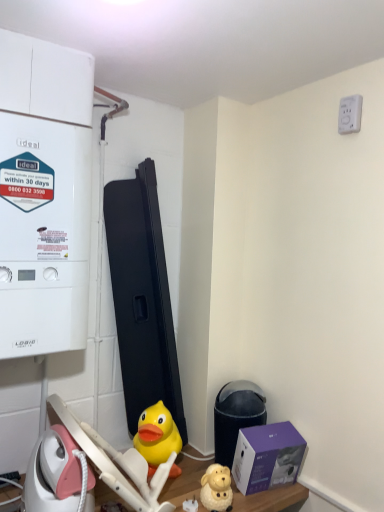
The image size is (384, 512). What do you see at coordinates (43, 234) in the screenshot? I see `white matte boiler at left` at bounding box center [43, 234].

You are a GUI agent. You are given a task and a screenshot of the screen. Output one action in this format:
    pyautogui.click(x=<x>, y=<y>)
    Task: Click on the white matte boiler at left
    The image size is (384, 512).
    Given the screenshot: What is the action you would take?
    pyautogui.click(x=43, y=234)

Could you measure the distance between black plastic water heater at lower right and matte yellow plastic dog at lower center, which appears as the 1th toy when viewed from the front?

8.17 inches.

From the image's perspective, which one is positioned lower, black plastic water heater at lower right or matte yellow plastic dog at lower center, the 1th toy when ordered from right to left?

matte yellow plastic dog at lower center, the 1th toy when ordered from right to left.

Is black plastic water heater at lower right to the left of matte yellow plastic dog at lower center, which appears as the 1th toy when viewed from the front, from the viewer's perspective?

In fact, black plastic water heater at lower right is to the right of matte yellow plastic dog at lower center, which appears as the 1th toy when viewed from the front.

Is black plastic water heater at lower right smaller than matte yellow plastic dog at lower center, which appears as the 1th toy when viewed from the front?

No.

Can you confirm if purple matte box at lower right is thinner than matte yellow plastic dog at lower center, which appears as the 1th toy when viewed from the front?

No.

Is point (247, 475) more distant than point (221, 493)?

Yes.

From a real-world perspective, who is located higher, purple matte box at lower right or matte yellow plastic dog at lower center, the 2th toy when ordered from back to front?

purple matte box at lower right, from a real-world perspective.

Could white matte boiler at left be considered to be inside yellow rubber duck at center, the 1th toy when ordered from back to front?

That's incorrect, white matte boiler at left is not inside yellow rubber duck at center, the 1th toy when ordered from back to front.

From a real-world perspective, which toy is the 1st one underneath the white matte boiler at left? Please provide its 2D coordinates.

[(157, 436)]

Visually, is yellow rubber duck at center, the 1th toy when ordered from back to front, positioned to the left or to the right of white matte boiler at left?

In the image, yellow rubber duck at center, the 1th toy when ordered from back to front, appears on the right side of white matte boiler at left.

From a real-world perspective, is yellow rubber duck at center, placed as the second toy when sorted from right to left, over white matte boiler at left?

No.

From a real-world perspective, is white matte boiler at left physically located above or below purple matte box at lower right?

white matte boiler at left is situated higher than purple matte box at lower right in the real world.

Is white matte boiler at left positioned in front of purple matte box at lower right?

Yes, it is.

Considering the positions of objects white matte boiler at left and purple matte box at lower right in the image provided, who is more to the right, white matte boiler at left or purple matte box at lower right?

purple matte box at lower right is more to the right.

Is black plastic water heater at lower right touching white matte boiler at left?

No, black plastic water heater at lower right is not making contact with white matte boiler at left.

Which is less distant, [216,432] or [67,216]?

Point [216,432] is positioned farther from the camera compared to point [67,216].

From a real-world perspective, which is physically below, black plastic water heater at lower right or white matte boiler at left?

From a 3D spatial view, black plastic water heater at lower right is below.

Looking at this image, considering the sizes of objects matte yellow plastic dog at lower center, which appears as the 1th toy when viewed from the front, and purple matte box at lower right in the image provided, who is shorter, matte yellow plastic dog at lower center, which appears as the 1th toy when viewed from the front, or purple matte box at lower right?

matte yellow plastic dog at lower center, which appears as the 1th toy when viewed from the front, is shorter.

Does matte yellow plastic dog at lower center, the 1th toy when ordered from right to left, touch purple matte box at lower right?

matte yellow plastic dog at lower center, the 1th toy when ordered from right to left, is not next to purple matte box at lower right, and they're not touching.

Considering the positions of point (222, 482) and point (246, 466), is point (222, 482) closer or farther from the camera than point (246, 466)?

Point (222, 482) appears to be closer to the viewer than point (246, 466).

Is matte yellow plastic dog at lower center, the 2th toy when ordered from back to front, facing away from purple matte box at lower right?

No.

Based on the photo, is matte yellow plastic dog at lower center, the 1th toy when ordered from right to left, turned away from white matte boiler at left?

No, white matte boiler at left is not at the back of matte yellow plastic dog at lower center, the 1th toy when ordered from right to left.

Which point is more distant from viewer, (220, 473) or (3, 159)?

The point (220, 473) is behind.

From their relative heights in the image, would you say matte yellow plastic dog at lower center, which appears as the 1th toy when viewed from the front, is taller or shorter than white matte boiler at left?

In the image, matte yellow plastic dog at lower center, which appears as the 1th toy when viewed from the front, appears to be shorter than white matte boiler at left.

Which object is further away from the camera, matte yellow plastic dog at lower center, the 1th toy when ordered from right to left, or white matte boiler at left?

matte yellow plastic dog at lower center, the 1th toy when ordered from right to left, is further from the camera.

You are a GUI agent. You are given a task and a screenshot of the screen. Output one action in this format:
    pyautogui.click(x=<x>, y=<y>)
    Task: Click on the water heater behind the matte yellow plastic dog at lower center, the 1th toy when ordered from right to left
    
    Given the screenshot: What is the action you would take?
    pyautogui.click(x=236, y=416)

In order to click on box above the matte yellow plastic dog at lower center, the 2th toy from the left (from the image's perspective) in this screenshot , I will do `click(267, 457)`.

Based on their spatial positions, is yellow rubber duck at center, placed as the second toy when sorted from right to left, or white matte boiler at left further from white plastic electric outlet at upper right?

yellow rubber duck at center, placed as the second toy when sorted from right to left, is further to white plastic electric outlet at upper right.

Looking at the image, which one is located further to black plastic water heater at lower right, white plastic electric outlet at upper right or purple matte box at lower right?

white plastic electric outlet at upper right is further to black plastic water heater at lower right.

Which object lies nearer to the anchor point black plastic water heater at lower right, purple matte box at lower right or matte yellow plastic dog at lower center, the 2th toy when ordered from back to front?

purple matte box at lower right is closer to black plastic water heater at lower right.

Based on their spatial positions, is white matte boiler at left or matte yellow plastic dog at lower center, the 2th toy from the left, closer to yellow rubber duck at center, the 1th toy when ordered from back to front?

Based on the image, matte yellow plastic dog at lower center, the 2th toy from the left, appears to be nearer to yellow rubber duck at center, the 1th toy when ordered from back to front.

Looking at the image, which one is located further to purple matte box at lower right, black plastic water heater at lower right or yellow rubber duck at center, placed as the second toy when sorted from right to left?

yellow rubber duck at center, placed as the second toy when sorted from right to left, lies further to purple matte box at lower right than the other object.

Estimate the real-world distances between objects in this image. Which object is further from black plastic water heater at lower right, white matte boiler at left or white plastic electric outlet at upper right?

Based on the image, white plastic electric outlet at upper right appears to be further to black plastic water heater at lower right.

Looking at the image, which one is located closer to white matte boiler at left, white plastic electric outlet at upper right or matte yellow plastic dog at lower center, the 1th toy when ordered from right to left?

matte yellow plastic dog at lower center, the 1th toy when ordered from right to left, is closer to white matte boiler at left.

From the image, which object appears to be farther from matte yellow plastic dog at lower center, which appears as the 1th toy when viewed from the front, white matte boiler at left or purple matte box at lower right?

white matte boiler at left is further to matte yellow plastic dog at lower center, which appears as the 1th toy when viewed from the front.

This screenshot has height=512, width=384. Find the location of `water heater between white plastic electric outlet at upper right and purple matte box at lower right in the vertical direction`. water heater between white plastic electric outlet at upper right and purple matte box at lower right in the vertical direction is located at coordinates click(236, 416).

Identify the location of water heater between white matte boiler at left and purple matte box at lower right in the up-down direction. This screenshot has width=384, height=512. tap(236, 416).

The width and height of the screenshot is (384, 512). In order to click on appliance between white plastic electric outlet at upper right and black plastic water heater at lower right vertically in this screenshot , I will do `click(43, 234)`.

This screenshot has width=384, height=512. In order to click on water heater between white matte boiler at left and yellow rubber duck at center, the 1th toy when ordered from back to front, from top to bottom in this screenshot , I will do `click(236, 416)`.